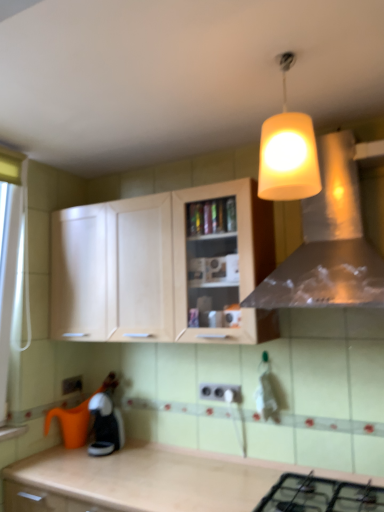
I want to click on empty space that is ontop of yellow matte lampshade at upper center (from a real-world perspective), so click(287, 58).